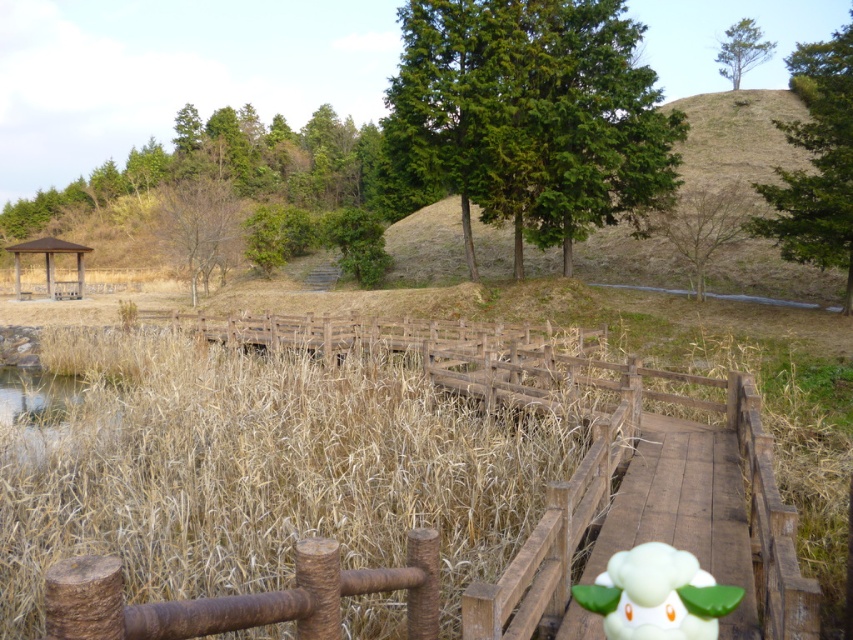
Question: Which of the following is the closest to the observer?

Choices:
 (A) dry grass at center
 (B) white matte plush toy at center
 (C) brown wooden gazebo at left

Answer: (B)

Question: In this image, where is dry grass at center located relative to brown wooden gazebo at left?

Choices:
 (A) right
 (B) left

Answer: (A)

Question: Which point is farther to the camera?

Choices:
 (A) brown wooden gazebo at left
 (B) dry grass at center

Answer: (A)

Question: Among these objects, which one is nearest to the camera?

Choices:
 (A) dry grass at center
 (B) white matte plush toy at center

Answer: (B)

Question: Is white matte plush toy at center thinner than brown wooden gazebo at left?

Choices:
 (A) no
 (B) yes

Answer: (B)

Question: In this image, where is dry grass at center located relative to white matte plush toy at center?

Choices:
 (A) above
 (B) below

Answer: (B)